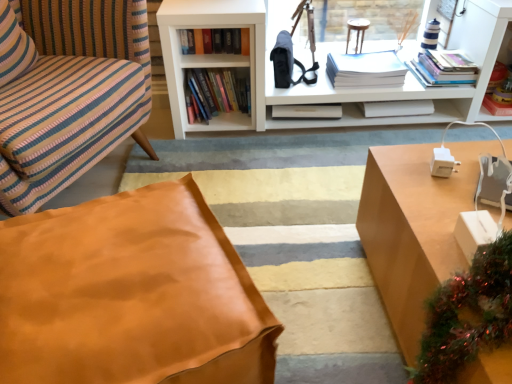
Question: Does point (207, 59) appear closer or farther from the camera than point (6, 77)?

Choices:
 (A) closer
 (B) farther

Answer: (B)

Question: In terms of size, does white matte bookcase at upper center appear bigger or smaller than striped fabric pillow at left?

Choices:
 (A) big
 (B) small

Answer: (A)

Question: Based on their relative distances, which object is farther from the striped fabric pillow at left?

Choices:
 (A) white matte bookcase at upper center
 (B) light brown wood desk at right
 (C) hardcover book at upper center, which appears as the first book when viewed from the left
 (D) white matte book at center, the fourth book from the left
 (E) white paper stack at upper center, the third book positioned from the right

Answer: (D)

Question: Which object is positioned closest to the white matte book at center, the fourth book from the left?

Choices:
 (A) white matte bookcase at upper center
 (B) leather ottoman at center
 (C) hardcover books at center, the 4th book from the right
 (D) white paper stack at upper center, which ranks as the 3th book in left-to-right order
 (E) striped fabric pillow at left

Answer: (D)